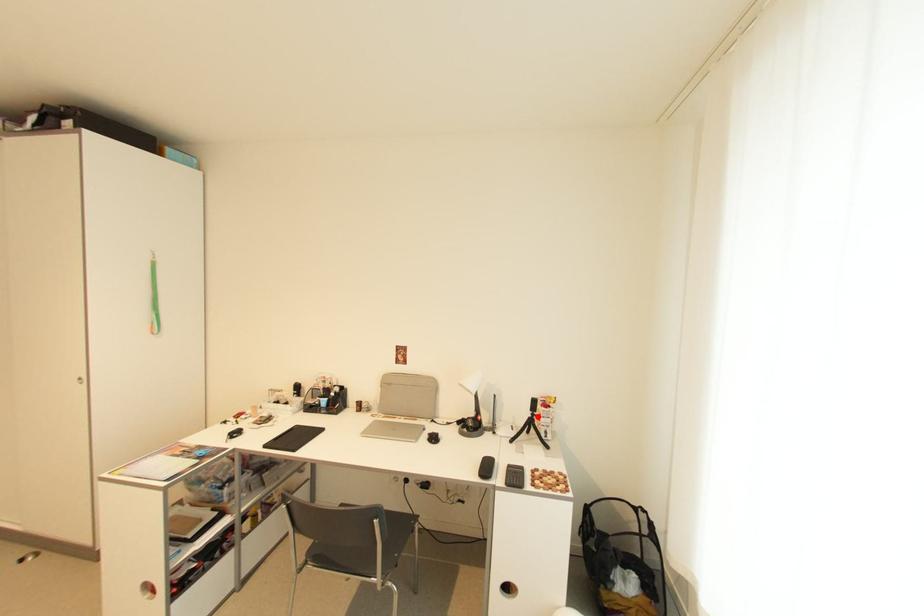
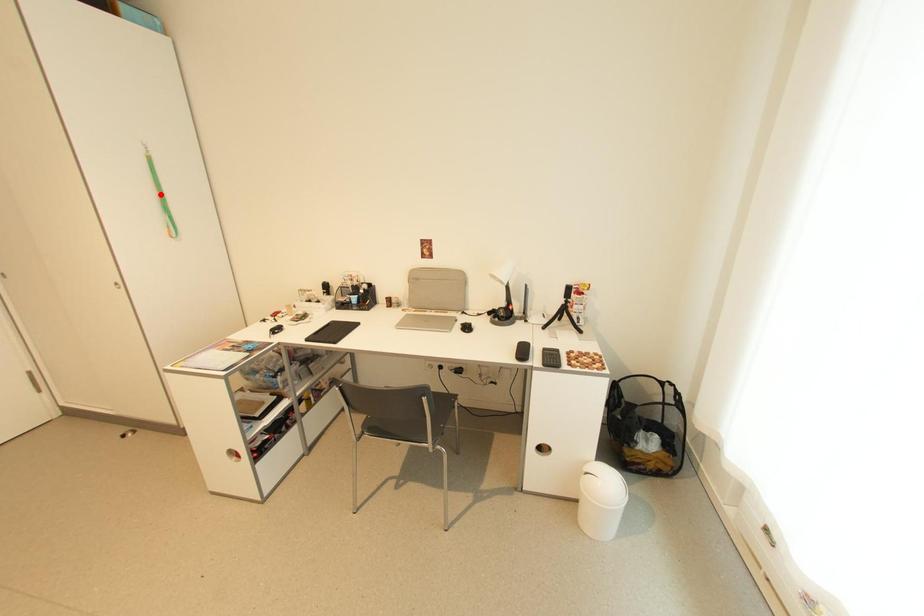
I am providing you with two images of the same scene from different viewpoints. A red point is marked on the first image and another point is marked on the second image. Does the point marked in image1 correspond to the same location as the one in image2?

No